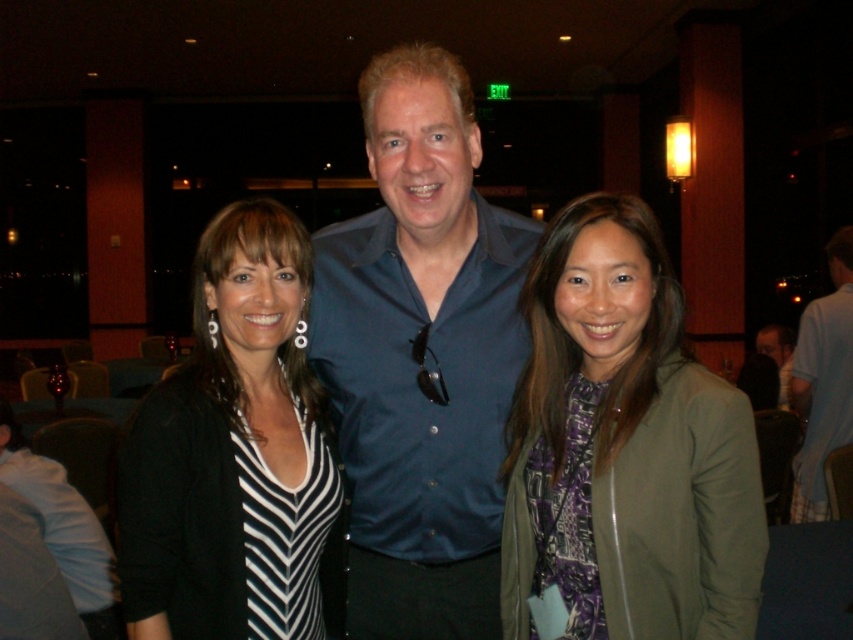
Question: Does blue button-down shirt at center have a greater width compared to black and white striped shirt at center?

Choices:
 (A) yes
 (B) no

Answer: (A)

Question: Observing the image, what is the correct spatial positioning of green matte jacket at center in reference to black and white striped shirt at center?

Choices:
 (A) right
 (B) left

Answer: (A)

Question: Can you confirm if green matte jacket at center is bigger than blue shirt at center?

Choices:
 (A) no
 (B) yes

Answer: (A)

Question: Which object is closer to the camera taking this photo?

Choices:
 (A) black and white striped shirt at center
 (B) blue button-down shirt at center
 (C) blue shirt at center

Answer: (A)

Question: Which of the following is the closest to the observer?

Choices:
 (A) blue button-down shirt at center
 (B) blue shirt at center
 (C) black and white striped shirt at center

Answer: (C)

Question: Which of the following is the closest to the observer?

Choices:
 (A) (184, 579)
 (B) (820, 428)
 (C) (467, 97)

Answer: (A)